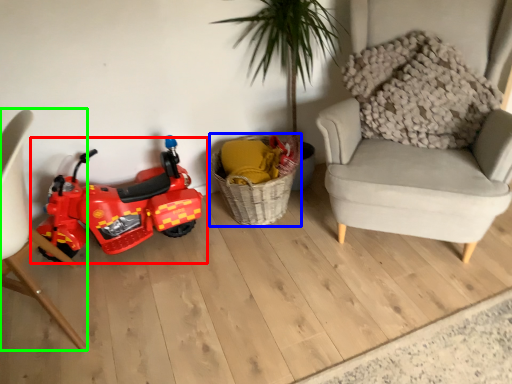
Question: Considering the real-world distances, which object is farthest from land vehicle (highlighted by a red box)? basket (highlighted by a blue box) or chair (highlighted by a green box)?

Choices:
 (A) basket
 (B) chair

Answer: (A)